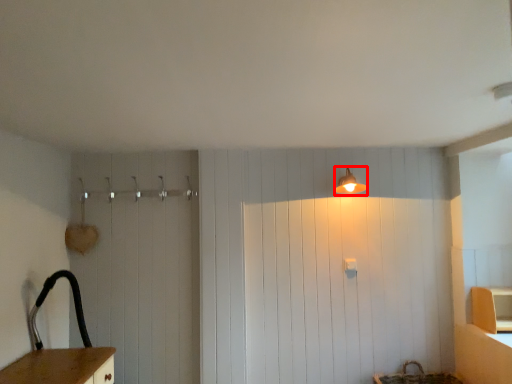
Question: Observing the image, what is the correct spatial positioning of light fixture (annotated by the red box) in reference to cabinetry?

Choices:
 (A) right
 (B) left

Answer: (B)